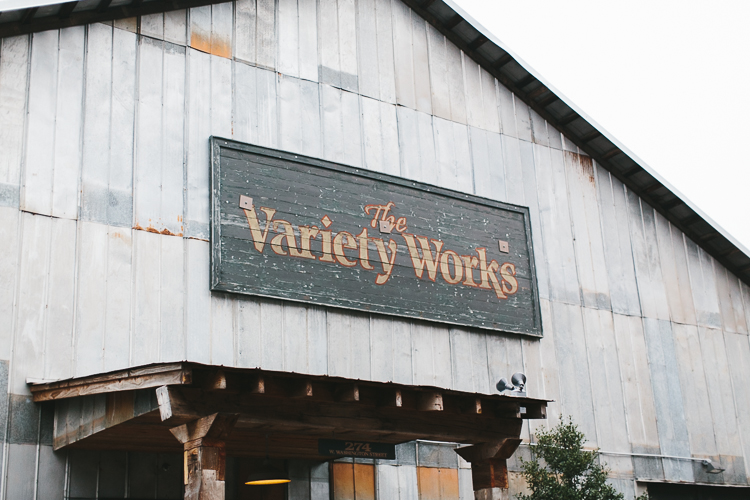
Locate an element on the screen. light is located at coordinates (714, 467), (271, 485), (500, 384), (516, 377).